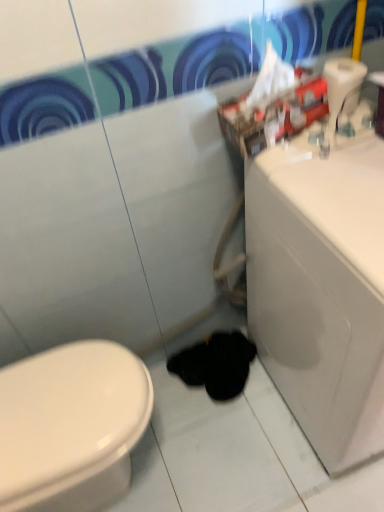
Question: From a real-world perspective, is black fuzzy animal at lower center positioned above or below white glossy sink at right?

Choices:
 (A) below
 (B) above

Answer: (A)

Question: Considering their positions, is black fuzzy animal at lower center located in front of or behind white glossy sink at right?

Choices:
 (A) behind
 (B) front

Answer: (A)

Question: Estimate the real-world distances between objects in this image. Which object is farther from the white glossy sink at right?

Choices:
 (A) black fuzzy animal at lower center
 (B) white plastic toilet paper at upper right

Answer: (A)

Question: Based on their relative distances, which object is nearer to the white plastic toilet paper at upper right?

Choices:
 (A) white glossy sink at right
 (B) black fuzzy animal at lower center

Answer: (A)